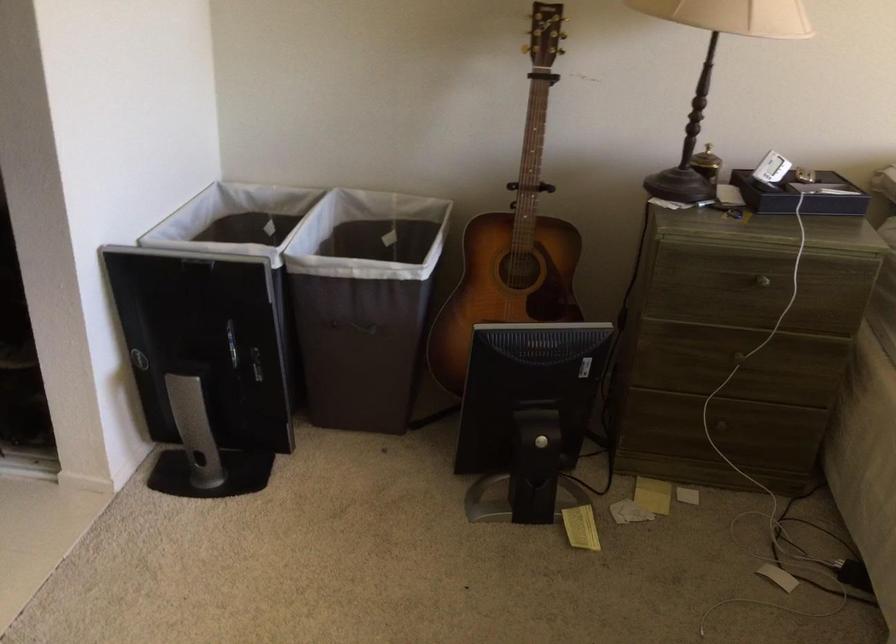
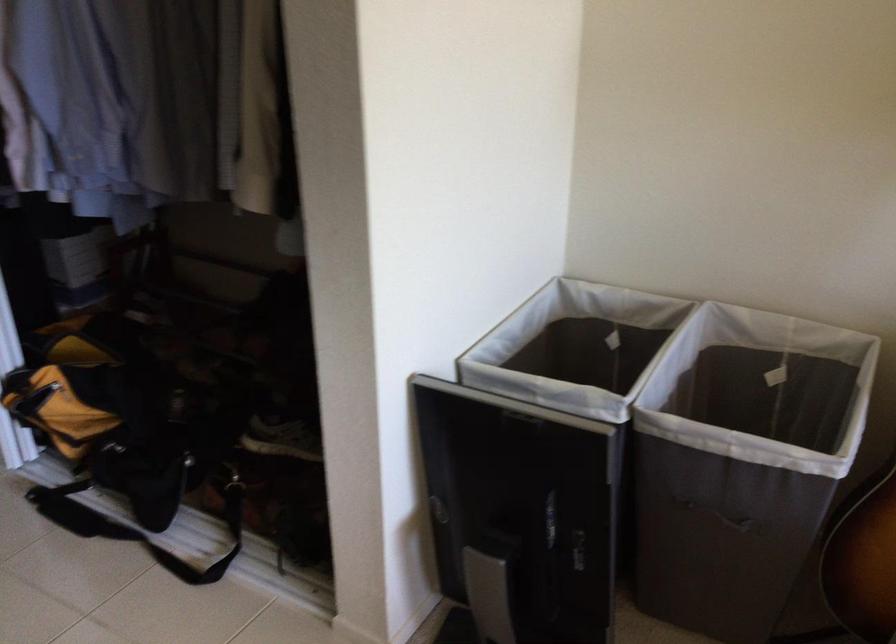
In the second image, find the point that corresponds to point 357,330 in the first image.

(719, 516)